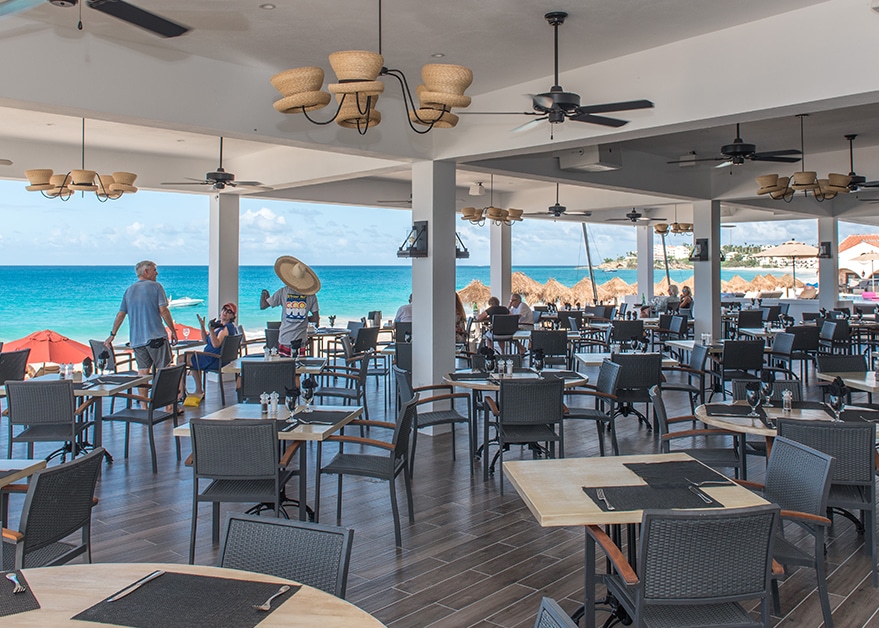
The width and height of the screenshot is (879, 628). In order to click on chair in this screenshot , I will do `click(631, 367)`.